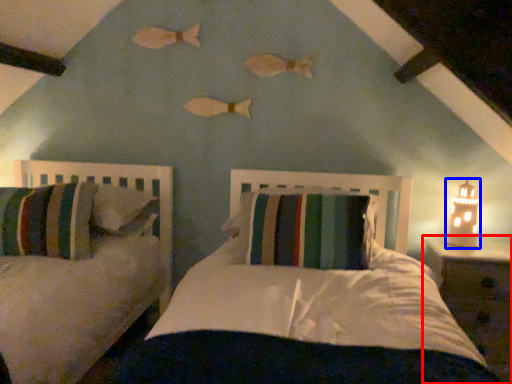
Question: Which object is further to the camera taking this photo, nightstand (highlighted by a red box) or table lamp (highlighted by a blue box)?

Choices:
 (A) nightstand
 (B) table lamp

Answer: (B)